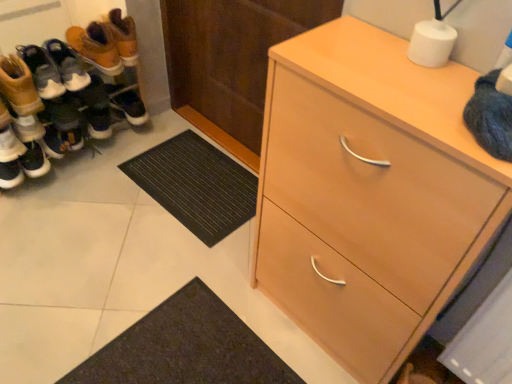
The width and height of the screenshot is (512, 384). Identify the location of free spot above leather boots at left, the second footwear viewed from the front (from a real-world perspective). (35, 53).